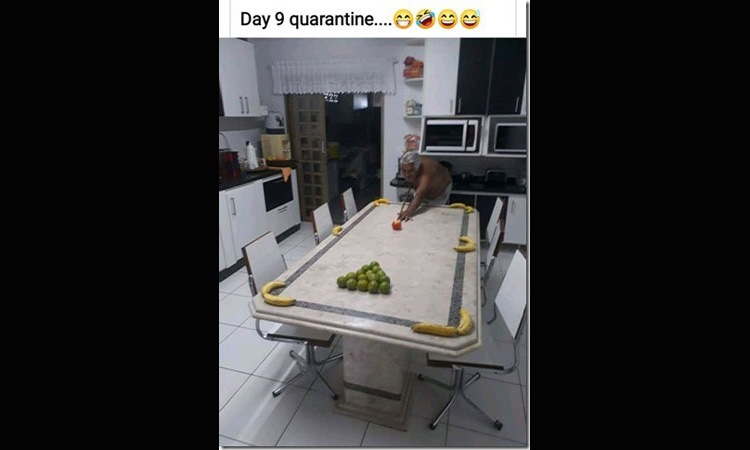
Where is `kitchen chair`? The width and height of the screenshot is (750, 450). kitchen chair is located at coordinates (261, 255), (327, 221), (351, 199), (496, 208), (489, 250), (512, 294).